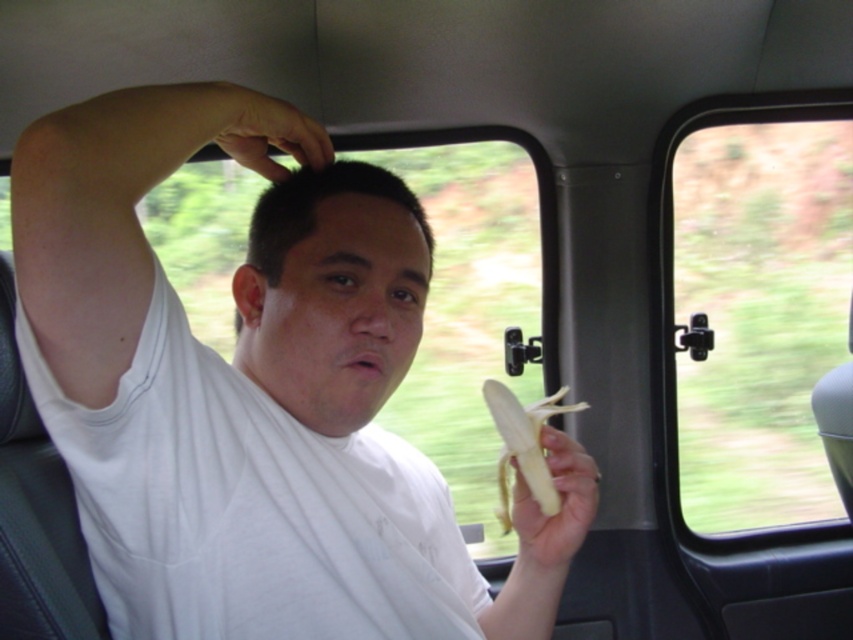
You are a delivery driver who needs to place a 12 inch long package between the white matte shirt at center and the window. Is there enough space?

The distance between the white matte shirt at center and the window is 23.40 inches. Since the package is 12 inches long, there is sufficient space to place it between them.

You are a photographer taking a photo of the interior of the vehicle. You notice two points marked in the scene at coordinates point (669, 422) and point (566, 440). Which point will appear closer to the camera in the final photo?

Point (566, 440) will appear closer to the camera in the final photo because it is closer to the photographer than point (669, 422), which is further away.

You are a photographer trying to capture a clear photo of the matte white head at center from your current position. Given that your camera has a minimum focusing distance of 30 inches, will you be able to take a clear photo without moving closer?

The matte white head at center is 32.01 inches away from camera, which is beyond the camera minimum focusing distance of 30 inches. Therefore, you can take a clear photo without moving closer.